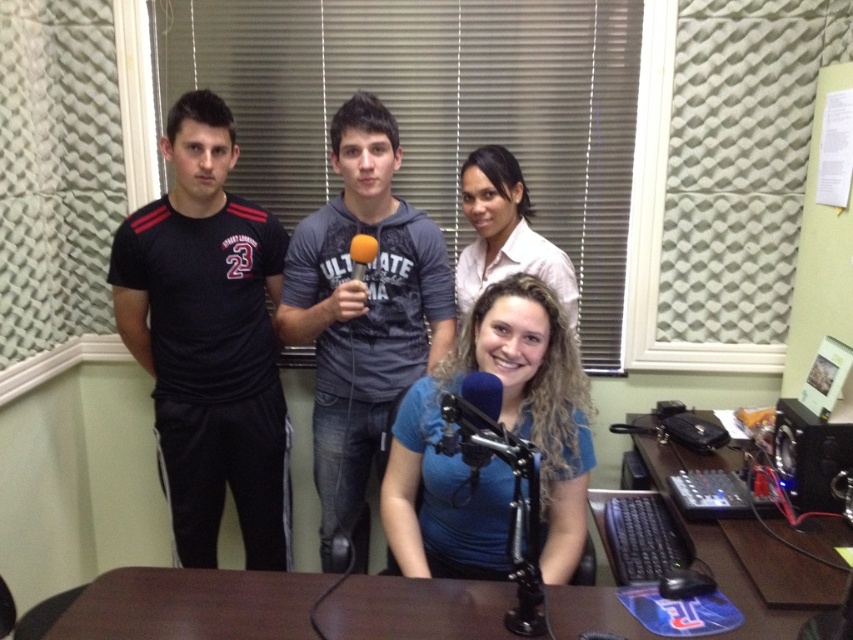
You are a guest on a radio show and need to sit in the empty chair next to the person wearing the gray cotton shirt at center. Which direction should you go from the person wearing the matte pink shirt at upper center to reach the empty chair?

To reach the empty chair next to the gray cotton shirt at center, you should go to the left of the matte pink shirt at upper center since the gray cotton shirt at center is located to its left.